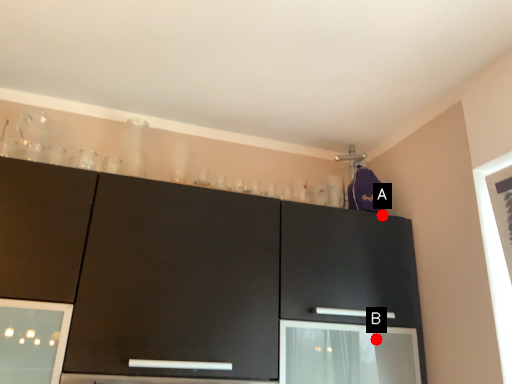
Question: Two points are circled on the image, labeled by A and B beside each circle. Which point is closer to the camera?

Choices:
 (A) A is closer
 (B) B is closer

Answer: (B)